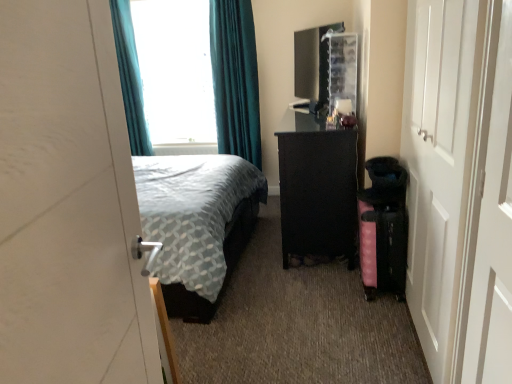
Question: Does white matte door at left, positioned as the first door in left-to-right order, come behind teal fabric curtain at upper left?

Choices:
 (A) no
 (B) yes

Answer: (A)

Question: Can you confirm if white matte door at left, which appears as the 2th door when viewed from the right, is positioned to the right of teal fabric curtain at upper left?

Choices:
 (A) no
 (B) yes

Answer: (B)

Question: Could teal fabric curtain at upper left be considered to be inside white matte door at left, marked as the second door in a back-to-front arrangement?

Choices:
 (A) yes
 (B) no

Answer: (B)

Question: Is white matte door at left, marked as the second door in a back-to-front arrangement, thinner than teal fabric curtain at upper left?

Choices:
 (A) no
 (B) yes

Answer: (B)

Question: Considering the relative sizes of white matte door at left, which appears as the 2th door when viewed from the right, and teal fabric curtain at upper left in the image provided, is white matte door at left, which appears as the 2th door when viewed from the right, smaller than teal fabric curtain at upper left?

Choices:
 (A) no
 (B) yes

Answer: (B)

Question: From the image's perspective, does white matte door at left, marked as the second door in a back-to-front arrangement, appear lower than teal fabric curtain at upper left?

Choices:
 (A) no
 (B) yes

Answer: (B)

Question: Considering the relative positions of white wooden door at right, acting as the 2th door starting from the left, and teal fabric curtain at upper left, the 2th curtain from the right, in the image provided, is white wooden door at right, acting as the 2th door starting from the left, behind teal fabric curtain at upper left, the 2th curtain from the right,?

Choices:
 (A) no
 (B) yes

Answer: (A)

Question: Can you confirm if white wooden door at right, the first door viewed from the back, is smaller than teal fabric curtain at upper left, positioned as the 1th curtain in left-to-right order?

Choices:
 (A) no
 (B) yes

Answer: (A)

Question: Is white wooden door at right, the first door from the right, facing towards teal fabric curtain at upper left, positioned as the 1th curtain in left-to-right order?

Choices:
 (A) yes
 (B) no

Answer: (B)

Question: Is the position of white wooden door at right, the first door viewed from the back, less distant than that of teal fabric curtain at upper left, positioned as the 1th curtain in left-to-right order?

Choices:
 (A) no
 (B) yes

Answer: (B)

Question: Is white wooden door at right, the first door from the right, shorter than teal fabric curtain at upper left, the 2th curtain from the right?

Choices:
 (A) yes
 (B) no

Answer: (B)

Question: Is white wooden door at right, the 2th door positioned from the front, taller than teal fabric curtain at upper left, positioned as the 1th curtain in left-to-right order?

Choices:
 (A) yes
 (B) no

Answer: (A)

Question: Does pink fabric suitcase at lower right appear on the left side of teal fabric curtain at upper left, the 2th curtain from the right?

Choices:
 (A) no
 (B) yes

Answer: (A)